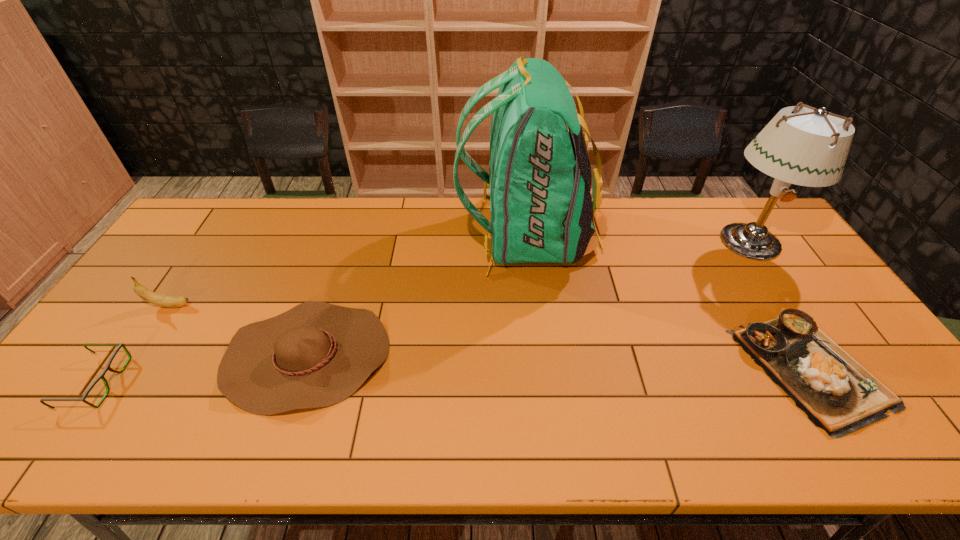
This screenshot has height=540, width=960. I want to click on banana positioned at the left edge, so click(157, 299).

The height and width of the screenshot is (540, 960). Find the location of `spectacles present at the left edge`. spectacles present at the left edge is located at coordinates (101, 376).

Where is `lampshade that is at the right edge`? This screenshot has height=540, width=960. lampshade that is at the right edge is located at coordinates (809, 148).

Find the location of `platter present at the right edge`. platter present at the right edge is located at coordinates (837, 394).

Find the location of a particular element. object present at the far right corner is located at coordinates (809, 148).

The width and height of the screenshot is (960, 540). What are the coordinates of `object situated at the near right corner` in the screenshot? It's located at (837, 394).

Locate an element on the screen. free region at the far edge is located at coordinates (443, 222).

Identify the location of vacant area at the left edge. (121, 356).

Identify the location of vacant space at the right edge. The image size is (960, 540). (808, 309).

Image resolution: width=960 pixels, height=540 pixels. Identify the location of vacant space at the far right corner of the desktop. (747, 211).